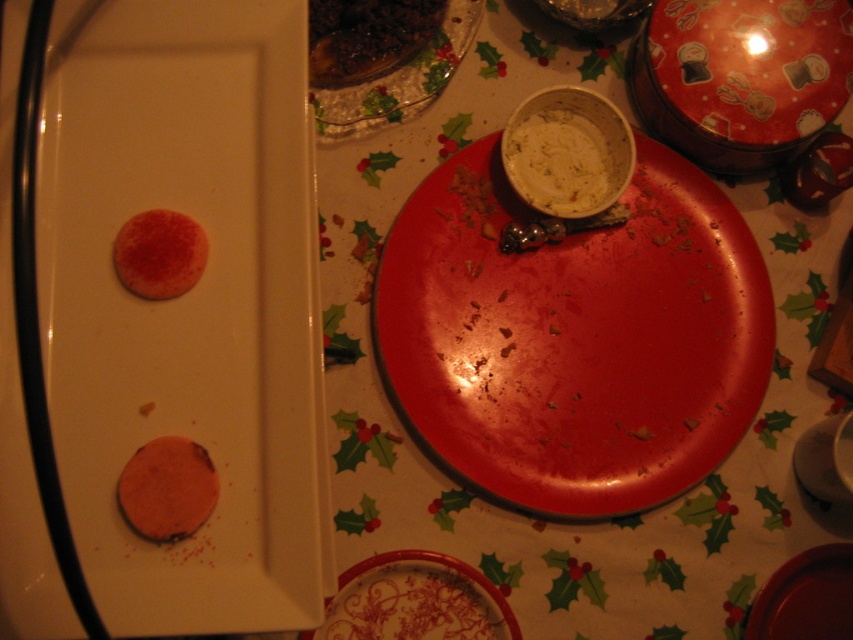
Question: Which of these objects is positioned closest to the porcelain plate with floral design at lower center?

Choices:
 (A) orange matte cookie at lower left
 (B) shiny brown meat at upper center
 (C) matte red cookie at upper left

Answer: (A)

Question: Is clear glass plate at upper center bigger than matte red cookie at upper left?

Choices:
 (A) yes
 (B) no

Answer: (A)

Question: Which object appears closest to the camera in this image?

Choices:
 (A) white creamy dip at upper center
 (B) shiny brown meat at upper center

Answer: (A)

Question: Which of the following is the closest to the observer?

Choices:
 (A) (161, 467)
 (B) (508, 170)

Answer: (A)

Question: Does shiny brown meat at upper center appear on the right side of matte red cookie at upper left?

Choices:
 (A) yes
 (B) no

Answer: (A)

Question: Can you confirm if porcelain plate with floral design at lower center is positioned below shiny brown meat at upper center?

Choices:
 (A) yes
 (B) no

Answer: (A)